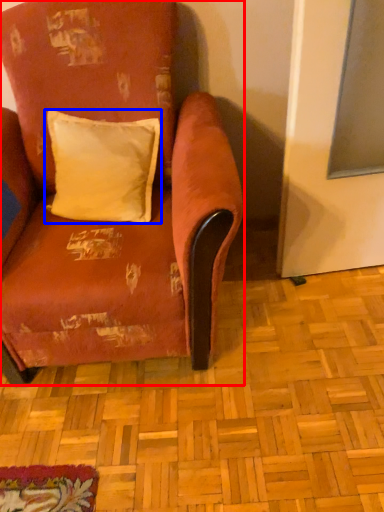
Question: Which object appears farthest to the camera in this image, chair (highlighted by a red box) or pillow (highlighted by a blue box)?

Choices:
 (A) chair
 (B) pillow

Answer: (B)